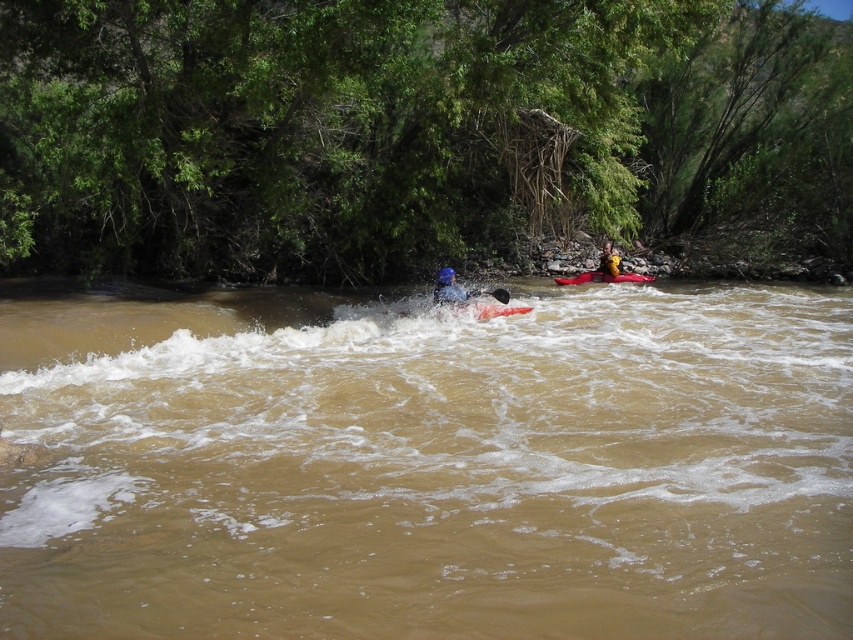
Question: Observing the image, what is the correct spatial positioning of matte blue kayak at center in reference to orange plastic canoe at center?

Choices:
 (A) below
 (B) above

Answer: (A)

Question: Which object is closer to the camera taking this photo?

Choices:
 (A) brown muddy water at center
 (B) yellow fabric life jacket at center

Answer: (A)

Question: In this image, where is smooth orange kayak at center located relative to yellow fabric life jacket at center?

Choices:
 (A) left
 (B) right

Answer: (A)

Question: Does orange plastic canoe at center appear on the left side of smooth orange kayak at center?

Choices:
 (A) no
 (B) yes

Answer: (A)

Question: Which of the following is the closest to the observer?

Choices:
 (A) yellow fabric kayak at center
 (B) yellow fabric life jacket at center
 (C) orange plastic canoe at center
 (D) smooth orange kayak at center

Answer: (D)

Question: Which object appears farthest from the camera in this image?

Choices:
 (A) yellow fabric life jacket at center
 (B) smooth orange kayak at center
 (C) yellow fabric kayak at center

Answer: (C)